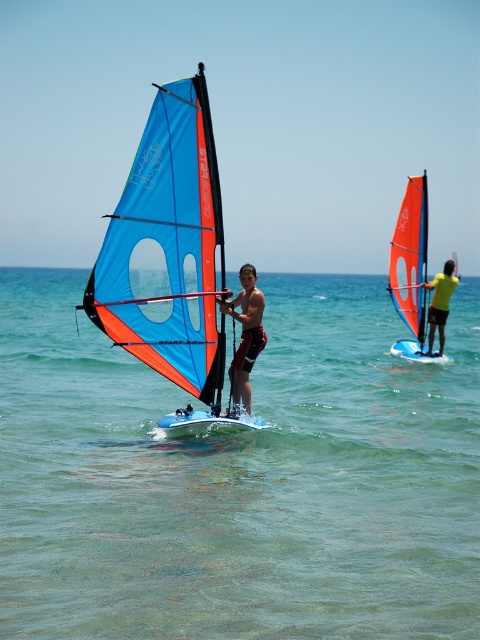
You are a photographer trying to capture the blue matte sail at center and the matte black windsurfing board at center in a single shot. Based on their positions, will the sail block the view of the board in your photo?

The blue matte sail at center is positioned over the matte black windsurfing board at center, so the sail will block the view of the board in the photo.

Looking at this image, you are a photographer trying to capture a photo of the orange sail at right and the clear blue water at center. Which object appears larger in the photo?

The clear blue water at center appears larger in the photo because it is much taller than the orange sail at right.

You are standing on the shore and want to take a photo of the matte black windsurfing board at center using a camera with a focal length of 50mm. If the camera is 36.37 feet away from the board, what is the approximate distance in millimeters should the lens focus to capture the board clearly?

The camera and the matte black windsurfing board at center are 36.37 feet apart. To capture the board clearly, the lens should be focused at approximately 36.37 feet, which converts to about 11,087 millimeters. However, in practical photography, lenses are often focused at the hyperfocal distance or use depth of field to ensure sharpness, but for precise focus on the board, the distance should be set to 36.37 feet.